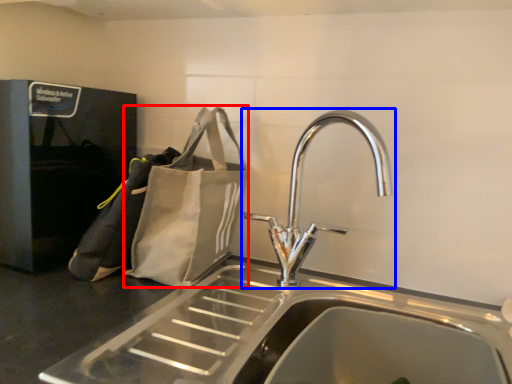
Question: Which point is further to the camera, pouch (highlighted by a red box) or tap (highlighted by a blue box)?

Choices:
 (A) pouch
 (B) tap

Answer: (A)